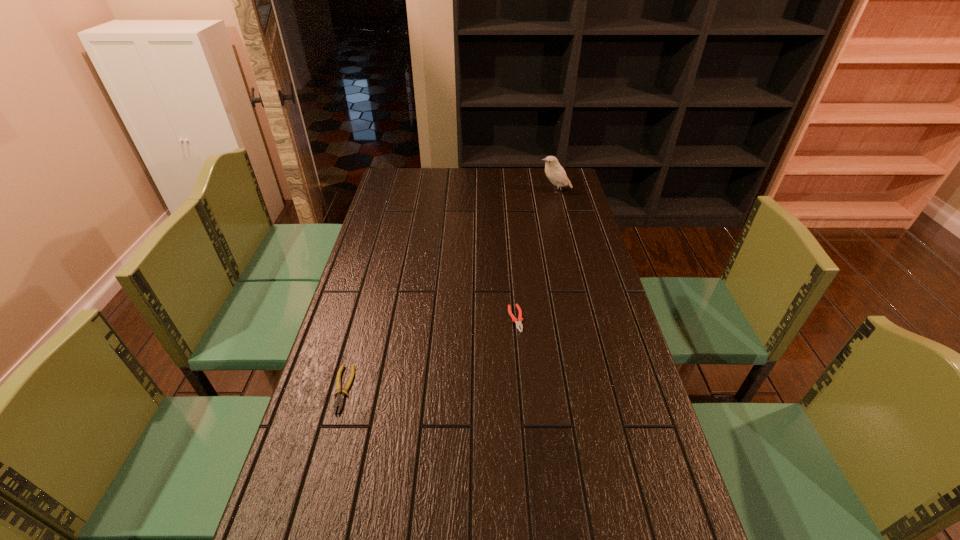
Identify the location of free region located 0.110m on the right of the second object from left to right. The image size is (960, 540). (559, 319).

Locate an element on the screen. object situated at the far edge is located at coordinates (554, 171).

Where is `object that is positioned at the left edge`? object that is positioned at the left edge is located at coordinates (339, 400).

At what (x,y) coordinates should I click in order to perform the action: click on object located at the right edge. Please return your answer as a coordinate pair (x, y). The width and height of the screenshot is (960, 540). Looking at the image, I should click on (554, 171).

I want to click on object present at the far right corner, so click(554, 171).

Where is `vacant area at the far edge`? vacant area at the far edge is located at coordinates (438, 170).

Identify the location of free region at the left edge of the desktop. (280, 492).

In the image, there is a desktop. At what (x,y) coordinates should I click in order to perform the action: click on blank space at the right edge. Please return your answer as a coordinate pair (x, y). Looking at the image, I should click on (554, 198).

What are the coordinates of `vacant space at the far right corner` in the screenshot? It's located at (569, 168).

In order to click on empty location between the bird and the nearer pliers in this screenshot , I will do `click(448, 290)`.